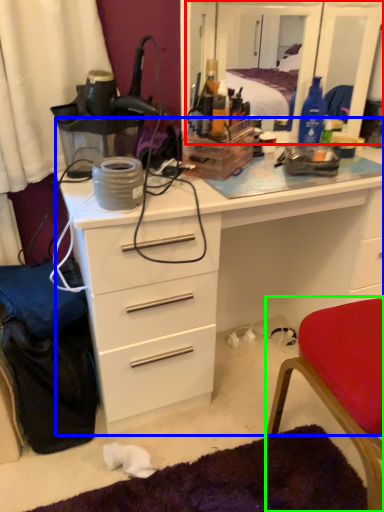
Question: Which is nearer to the mirror (highlighted by a red box)? chest of drawers (highlighted by a blue box) or chair (highlighted by a green box).

Choices:
 (A) chest of drawers
 (B) chair

Answer: (A)